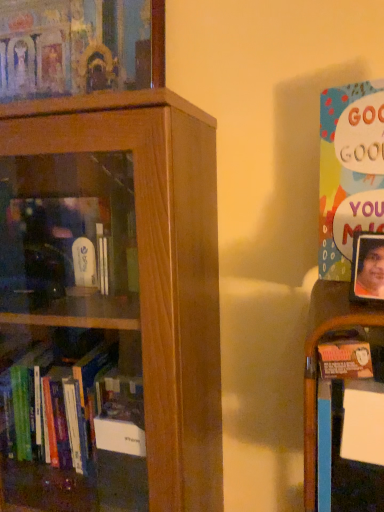
Question: Is brown wooden bookcase at left far away from matte wooden frame at upper left, which is the 1th book in left-to-right order?

Choices:
 (A) yes
 (B) no

Answer: (B)

Question: From the image's perspective, is brown wooden bookcase at left on matte wooden frame at upper left, which is the 1th book in left-to-right order?

Choices:
 (A) no
 (B) yes

Answer: (A)

Question: Does brown wooden bookcase at left come behind matte wooden frame at upper left, which is the 2th book from front to back?

Choices:
 (A) no
 (B) yes

Answer: (A)

Question: Is brown wooden bookcase at left closer to the viewer compared to matte wooden frame at upper left, the 1th book in the back-to-front sequence?

Choices:
 (A) yes
 (B) no

Answer: (A)

Question: Is brown wooden bookcase at left looking in the opposite direction of matte wooden frame at upper left, the 2th book viewed from the right?

Choices:
 (A) no
 (B) yes

Answer: (A)

Question: In the image, is multicolored paper poster at right, which is the 1th book in bottom-to-top order, on the left side or the right side of brown wooden bookcase at left?

Choices:
 (A) left
 (B) right

Answer: (B)

Question: Considering the positions of multicolored paper poster at right, the 2th book viewed from the left, and brown wooden bookcase at left in the image, is multicolored paper poster at right, the 2th book viewed from the left, taller or shorter than brown wooden bookcase at left?

Choices:
 (A) short
 (B) tall

Answer: (A)

Question: In terms of size, does multicolored paper poster at right, the first book viewed from the front, appear bigger or smaller than brown wooden bookcase at left?

Choices:
 (A) big
 (B) small

Answer: (B)

Question: From the image's perspective, is multicolored paper poster at right, the first book viewed from the front, positioned above or below brown wooden bookcase at left?

Choices:
 (A) below
 (B) above

Answer: (B)

Question: Is multicolored paper poster at right, the second book positioned from the back, spatially inside wooden shelf at right, or outside of it?

Choices:
 (A) outside
 (B) inside

Answer: (A)

Question: From their relative heights in the image, would you say multicolored paper poster at right, the first book viewed from the front, is taller or shorter than wooden shelf at right?

Choices:
 (A) tall
 (B) short

Answer: (A)

Question: Would you say multicolored paper poster at right, the first book viewed from the front, is to the left or to the right of wooden shelf at right in the picture?

Choices:
 (A) right
 (B) left

Answer: (A)

Question: Is multicolored paper poster at right, the 2th book viewed from the left, wider or thinner than wooden shelf at right?

Choices:
 (A) thin
 (B) wide

Answer: (A)

Question: In the image, is wooden shelf at right positioned in front of or behind brown wooden bookcase at left?

Choices:
 (A) front
 (B) behind

Answer: (B)

Question: In terms of height, does wooden shelf at right look taller or shorter compared to brown wooden bookcase at left?

Choices:
 (A) tall
 (B) short

Answer: (B)